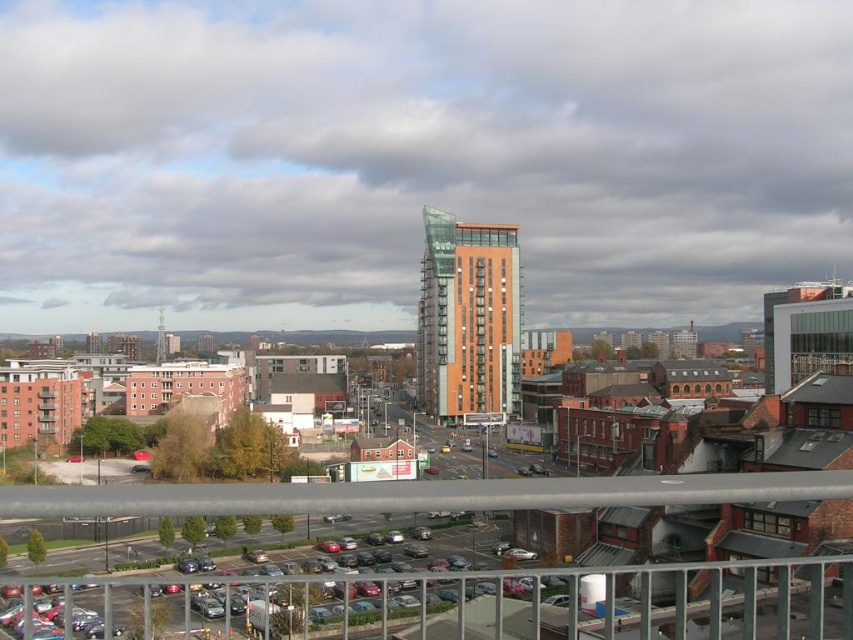
Can you confirm if gray metallic rail at lower center is bigger than metal at center?

No.

Identify the location of gray metallic rail at lower center. (419, 493).

Image resolution: width=853 pixels, height=640 pixels. What are the coordinates of `gray metallic rail at lower center` in the screenshot? It's located at (419, 493).